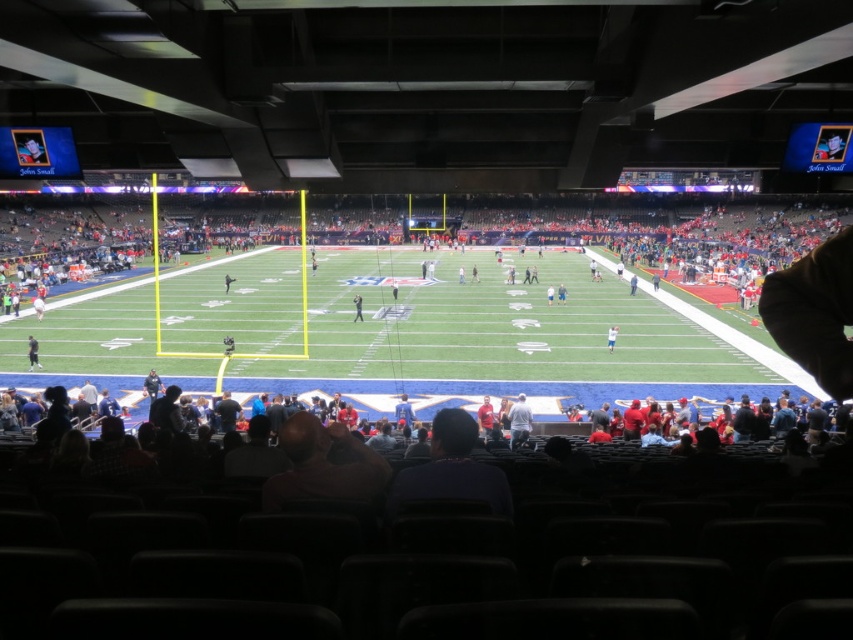
Question: Which is farther from the gray fabric jacket at center?

Choices:
 (A) white cotton shirt at center
 (B) light blue shirt at center
 (C) light brown leather jacket at lower left
 (D) dark blue shirt at center

Answer: (B)

Question: Does dark blue uniform at center appear on the left side of light blue shirt at center?

Choices:
 (A) no
 (B) yes

Answer: (B)

Question: Considering the real-world distances, which object is farthest from the gray fabric jacket at center?

Choices:
 (A) dark blue jersey at center
 (B) dark blue uniform at center

Answer: (A)

Question: Is dark blue shirt at center to the right of light brown leather jacket at lower left from the viewer's perspective?

Choices:
 (A) no
 (B) yes

Answer: (B)

Question: Which point is closer to the camera taking this photo?

Choices:
 (A) (509, 419)
 (B) (547, 301)
 (C) (33, 362)
 (D) (611, 346)

Answer: (A)

Question: Is dark blue shirt at center below light blue shirt at center?

Choices:
 (A) no
 (B) yes

Answer: (B)